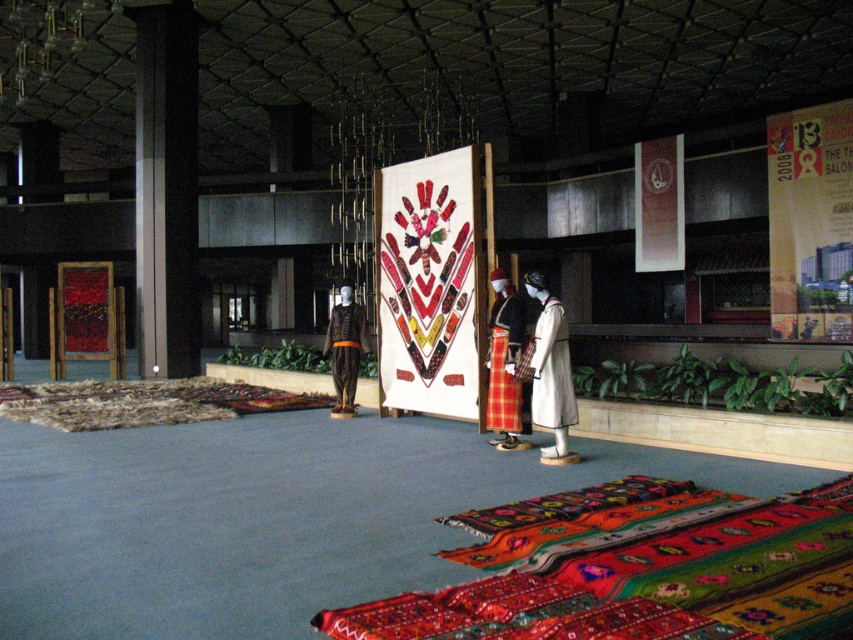
Question: Is white matte robe at center wider than matte black robe at center?

Choices:
 (A) no
 (B) yes

Answer: (A)

Question: Observing the image, what is the correct spatial positioning of plaid fabric robe at center in reference to matte black robe at center?

Choices:
 (A) left
 (B) right

Answer: (B)

Question: Which object is positioned closest to the matte black robe at center?

Choices:
 (A) vibrant woven rug at lower center
 (B) white matte robe at center
 (C) plaid fabric robe at center

Answer: (C)

Question: Which point is closer to the camera?

Choices:
 (A) vibrant woven rug at lower center
 (B) multicolored woven rug at center
 (C) matte black robe at center
 (D) white matte robe at center

Answer: (A)

Question: Does multicolored woven rug at center appear over white matte robe at center?

Choices:
 (A) yes
 (B) no

Answer: (B)

Question: Which of the following is the closest to the observer?

Choices:
 (A) (346, 355)
 (B) (843, 509)
 (C) (488, 410)
 (D) (82, 417)

Answer: (B)